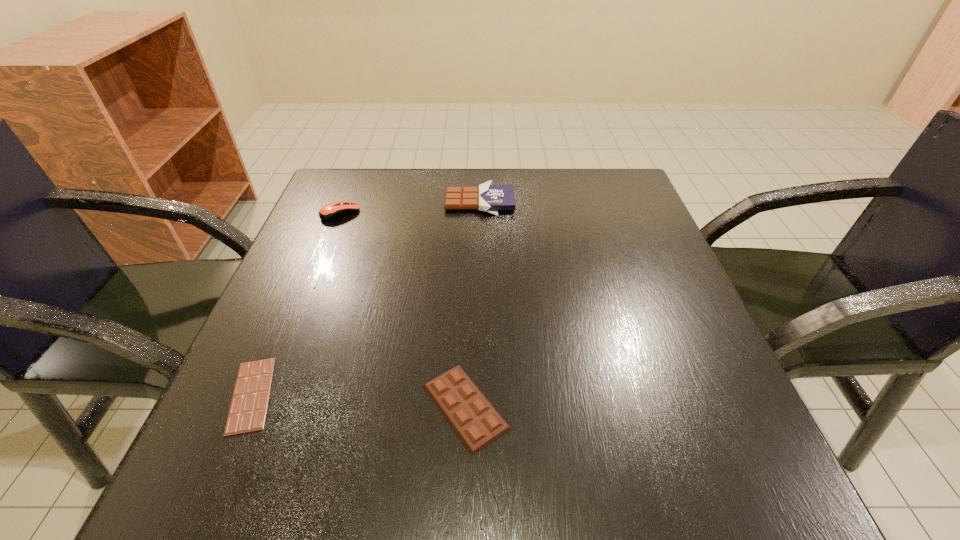
Locate an element on the screen. This screenshot has height=540, width=960. vacant space at the far right corner of the desktop is located at coordinates (605, 180).

In the image, there is a desktop. What are the coordinates of `vacant space at the near right corner` in the screenshot? It's located at (703, 445).

At what (x,y) coordinates should I click in order to perform the action: click on empty location between the computer mouse and the shortest chocolate bar. Please return your answer as a coordinate pair (x, y). Image resolution: width=960 pixels, height=540 pixels. Looking at the image, I should click on (296, 304).

This screenshot has height=540, width=960. I want to click on free space between the leftmost chocolate bar and the farthest chocolate bar, so point(366,298).

Image resolution: width=960 pixels, height=540 pixels. In order to click on blank region between the shortest object and the farthest chocolate bar in this screenshot , I will do `click(366, 298)`.

Where is `free space between the leftmost chocolate bar and the third tallest object`? The height and width of the screenshot is (540, 960). free space between the leftmost chocolate bar and the third tallest object is located at coordinates (358, 401).

Locate an element on the screen. The width and height of the screenshot is (960, 540). empty location between the shortest chocolate bar and the computer mouse is located at coordinates tap(296, 304).

Find the location of `unoccupied position between the computer mouse and the second tallest chocolate bar`. unoccupied position between the computer mouse and the second tallest chocolate bar is located at coordinates (403, 310).

I want to click on vacant space that's between the tallest chocolate bar and the second tallest chocolate bar, so click(x=472, y=305).

The width and height of the screenshot is (960, 540). I want to click on free point between the second tallest chocolate bar and the tallest chocolate bar, so click(472, 305).